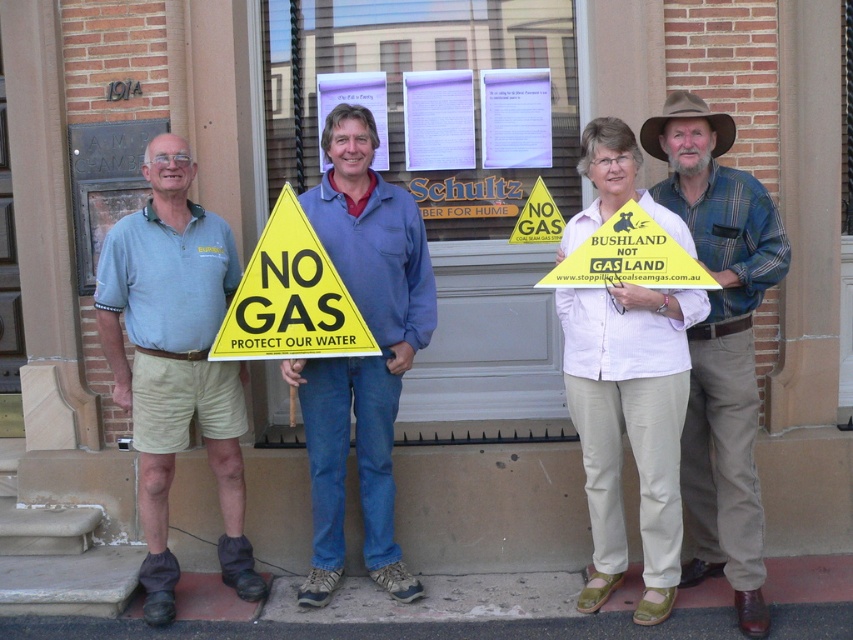
Between yellow paper triangle at center and yellow paper sign at center, which one has more height?

yellow paper triangle at center is taller.

Is point (303, 308) positioned in front of point (643, 253)?

That is False.

At what (x,y) coordinates should I click in order to perform the action: click on yellow paper triangle at center. Please return your answer as a coordinate pair (x, y). This screenshot has width=853, height=640. Looking at the image, I should click on (289, 298).

Measure the distance between blue denim jeans at center and brown felt cowboy hat at upper center.

blue denim jeans at center and brown felt cowboy hat at upper center are 3.67 feet apart from each other.

This screenshot has height=640, width=853. Find the location of `blue denim jeans at center`. blue denim jeans at center is located at coordinates (361, 356).

Can you confirm if light blue shirt at center is thinner than white cotton shirt at center?

No, light blue shirt at center is not thinner than white cotton shirt at center.

In order to click on light blue shirt at center in this screenshot , I will do `click(175, 362)`.

This screenshot has width=853, height=640. I want to click on light blue shirt at center, so click(x=175, y=362).

You are a GUI agent. You are given a task and a screenshot of the screen. Output one action in this format:
    pyautogui.click(x=<x>, y=<y>)
    Task: Click on the light blue shirt at center
    
    Given the screenshot: What is the action you would take?
    pyautogui.click(x=175, y=362)